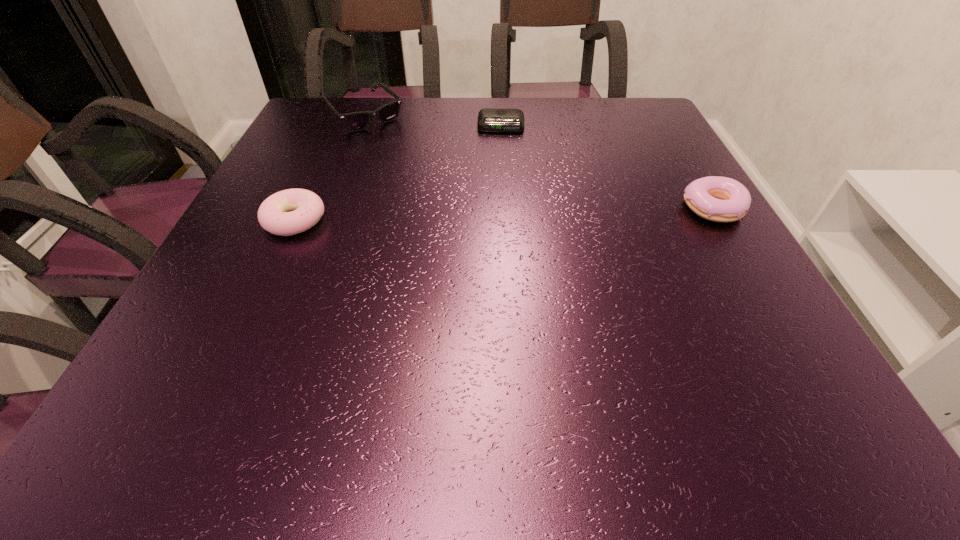
You are a GUI agent. You are given a task and a screenshot of the screen. Output one action in this format:
    pyautogui.click(x=<x>, y=<y>)
    Task: Click on the shorter doughnut
    
    Given the screenshot: What is the action you would take?
    pyautogui.click(x=292, y=211)

At what (x,y) coordinates should I click in order to perform the action: click on the second shortest object. Please return your answer as a coordinate pair (x, y). Looking at the image, I should click on (292, 211).

Where is `the rightmost object`? This screenshot has width=960, height=540. the rightmost object is located at coordinates (720, 199).

Where is `the shortest object`? The height and width of the screenshot is (540, 960). the shortest object is located at coordinates (489, 119).

Find the location of `the third object from left to right`. the third object from left to right is located at coordinates tap(489, 119).

Find the location of `sunglasses`. sunglasses is located at coordinates (356, 121).

Locate an element on the screen. vacant space situated on the right of the left doughnut is located at coordinates (454, 220).

In order to click on vacant position located on the left of the right doughnut in this screenshot , I will do `click(548, 208)`.

Identify the location of free point located on the display of the alarm clock. (499, 195).

Find the location of a particular element. The height and width of the screenshot is (540, 960). free space located 0.400m on the display of the alarm clock is located at coordinates (498, 234).